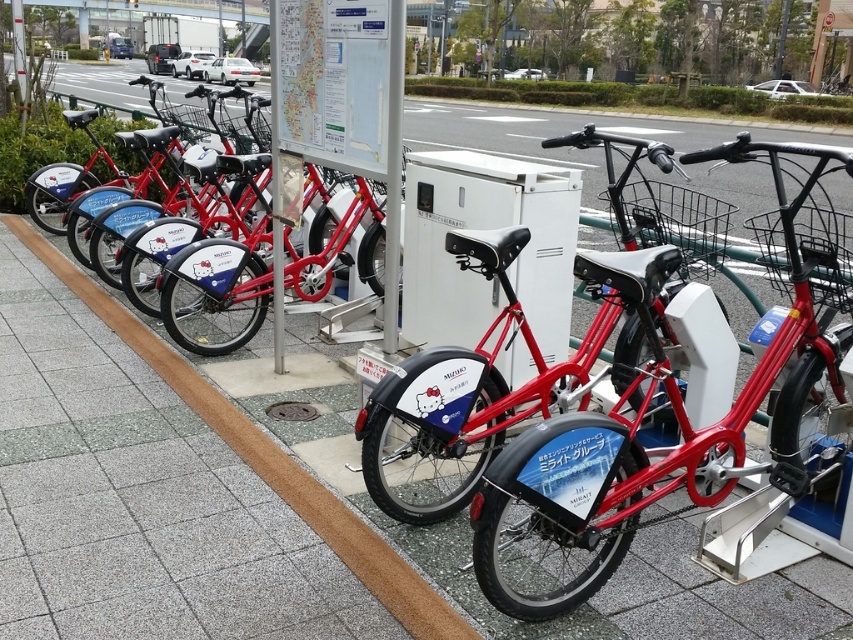
You are a delivery person who needs to place a small white paper at upper center on top of the matte black bicycle at center without covering its decorative sticker. Is this possible based on their sizes?

The white paper at upper center is not as tall as the matte black bicycle at center, so it can be placed on top without covering the decorative sticker.

You are a delivery person needing to choose a bike for a long trip. You know that bigger bikes can carry more weight. Which bike should you choose between the metallic red bicycle at center and the matte red bicycle at center?

The metallic red bicycle at center is bigger than the matte red bicycle at center, so you should choose the metallic red bicycle at center for the long trip as it can carry more weight.

You are standing at the bike station and notice a point marked at coordinates [339,83]. What object is located at that position?

The point at coordinates [339,83] indicates the white paper at upper center.